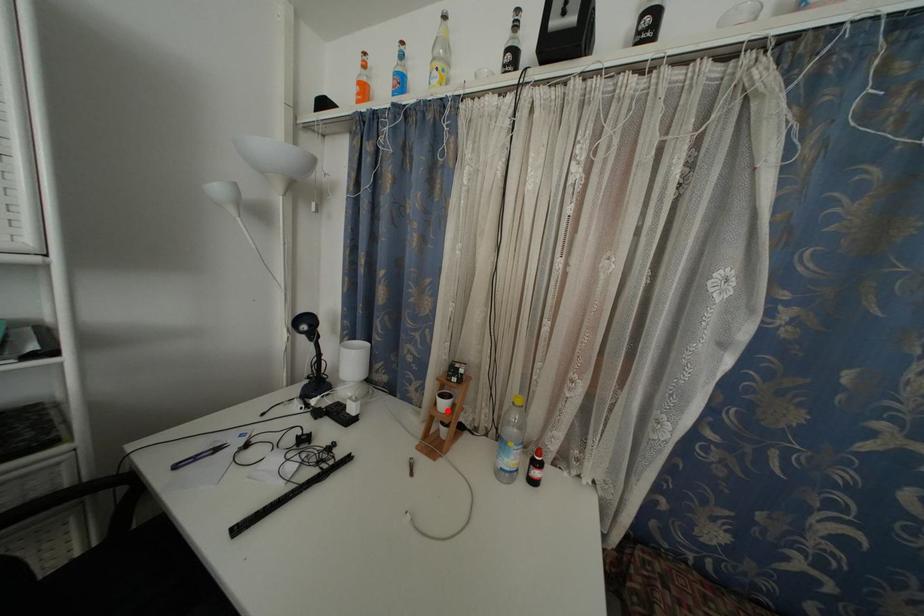
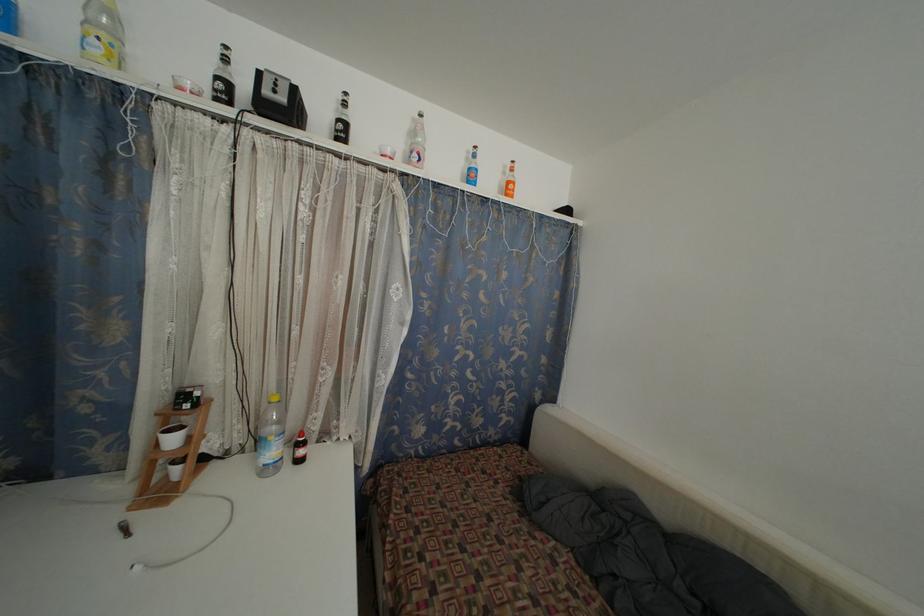
Where in the second image is the point corresponding to the highlighted location from the first image?

(176, 446)